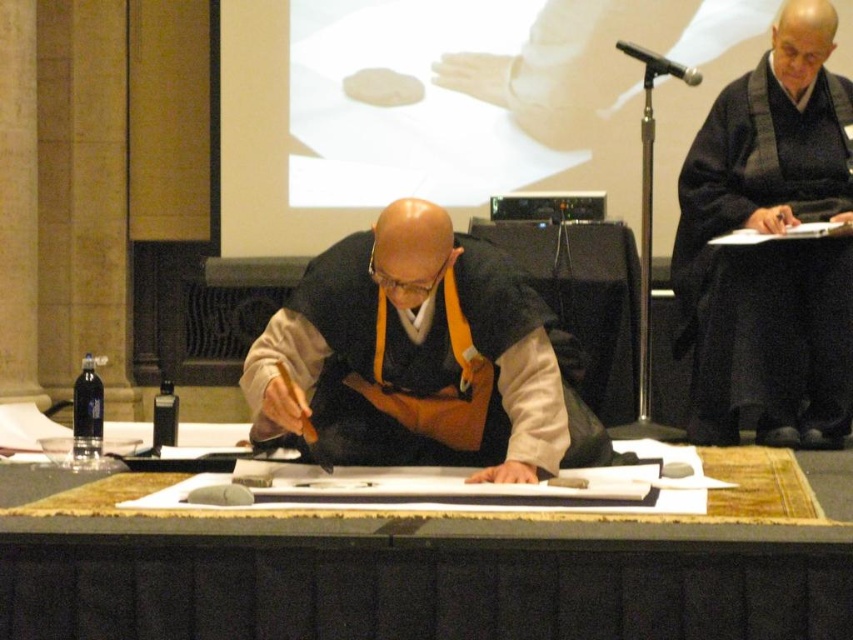
Does wooden table at center appear on the right side of matte black robe at center?

Correct, you'll find wooden table at center to the right of matte black robe at center.

This screenshot has width=853, height=640. Describe the element at coordinates (421, 579) in the screenshot. I see `wooden table at center` at that location.

Image resolution: width=853 pixels, height=640 pixels. What are the coordinates of `wooden table at center` in the screenshot? It's located at (421, 579).

Does matte black robe at center come behind black matte robe at upper right?

No, matte black robe at center is in front of black matte robe at upper right.

Is point (491, 429) positioned in front of point (828, 177)?

Yes.

At what (x,y) coordinates should I click in order to perform the action: click on matte black robe at center. Please return your answer as a coordinate pair (x, y). The image size is (853, 640). Looking at the image, I should click on (421, 356).

Does wooden table at center have a greater width compared to black matte robe at upper right?

Indeed, wooden table at center has a greater width compared to black matte robe at upper right.

Between wooden table at center and black matte robe at upper right, which one appears on the left side from the viewer's perspective?

From the viewer's perspective, wooden table at center appears more on the left side.

Is point (202, 579) positioned before point (720, 145)?

That is True.

The height and width of the screenshot is (640, 853). What are the coordinates of `wooden table at center` in the screenshot? It's located at (421, 579).